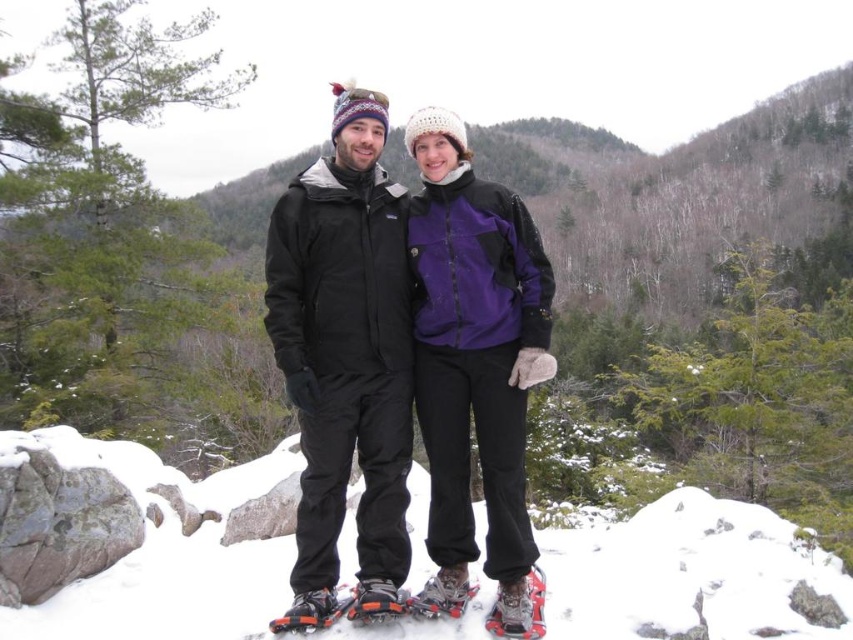
Question: Considering the relative positions of matte gray ski boot at center and orange matte ski boot at center in the image provided, where is matte gray ski boot at center located with respect to orange matte ski boot at center?

Choices:
 (A) above
 (B) below

Answer: (B)

Question: Does orange mesh snowshoe at lower center lie in front of silver metallic snowshoe at center?

Choices:
 (A) yes
 (B) no

Answer: (A)

Question: Which object appears closest to the camera in this image?

Choices:
 (A) brushed metal snowshoe at lower center
 (B) silver metallic snowshoe at center
 (C) orange matte ski boot at center

Answer: (A)

Question: Observing the image, what is the correct spatial positioning of orange and black snowshoes at center in reference to matte gray ski boot at center?

Choices:
 (A) right
 (B) left

Answer: (B)

Question: Based on their relative distances, which object is nearer to the white fluffy snow at center?

Choices:
 (A) brushed metal snowshoe at lower center
 (B) orange and black snowshoes at center
 (C) orange matte ski boot at center

Answer: (A)

Question: Which point appears closest to the camera in this image?

Choices:
 (A) (376, 605)
 (B) (361, 260)
 (C) (457, 600)
 (D) (428, 291)

Answer: (A)